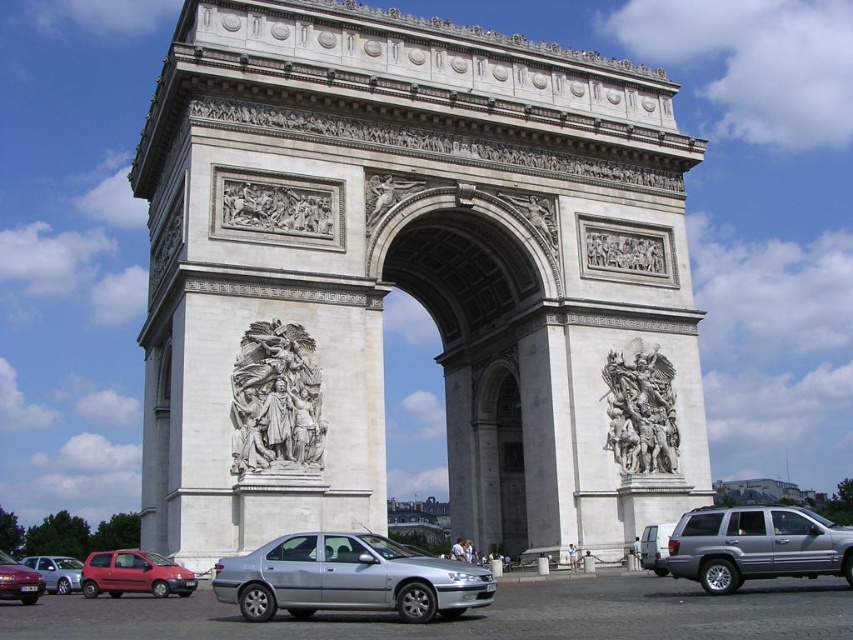
Question: Can you confirm if white stone arch at center is positioned above silver metallic sedan at lower left?

Choices:
 (A) no
 (B) yes

Answer: (B)

Question: Does matte red hatchback at lower left have a greater width compared to matte red car at lower left?

Choices:
 (A) yes
 (B) no

Answer: (A)

Question: Which point is closer to the camera taking this photo?

Choices:
 (A) (67, 592)
 (B) (207, 173)
 (C) (654, 557)
 (D) (672, 376)

Answer: (C)

Question: Which point appears closest to the camera in this image?

Choices:
 (A) (154, 576)
 (B) (839, 561)
 (C) (241, 368)
 (D) (643, 426)

Answer: (B)

Question: Can you confirm if polished bronze sculpture at center is positioned above silver metallic sedan at lower left?

Choices:
 (A) yes
 (B) no

Answer: (A)

Question: Among these points, which one is nearest to the camera?

Choices:
 (A) (578, 60)
 (B) (440, 564)
 (C) (776, 529)
 (D) (86, 593)

Answer: (B)